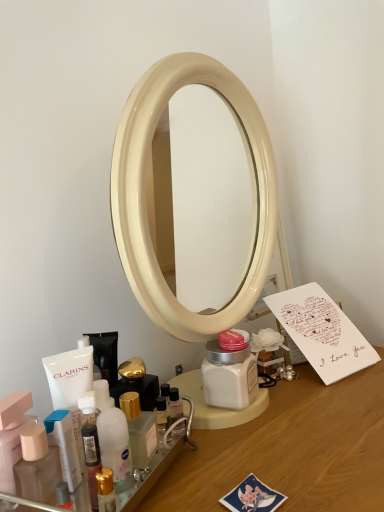
Where is `free point above wooden desk at center (from a real-world perspective)`? Image resolution: width=384 pixels, height=512 pixels. free point above wooden desk at center (from a real-world perspective) is located at coordinates (280, 423).